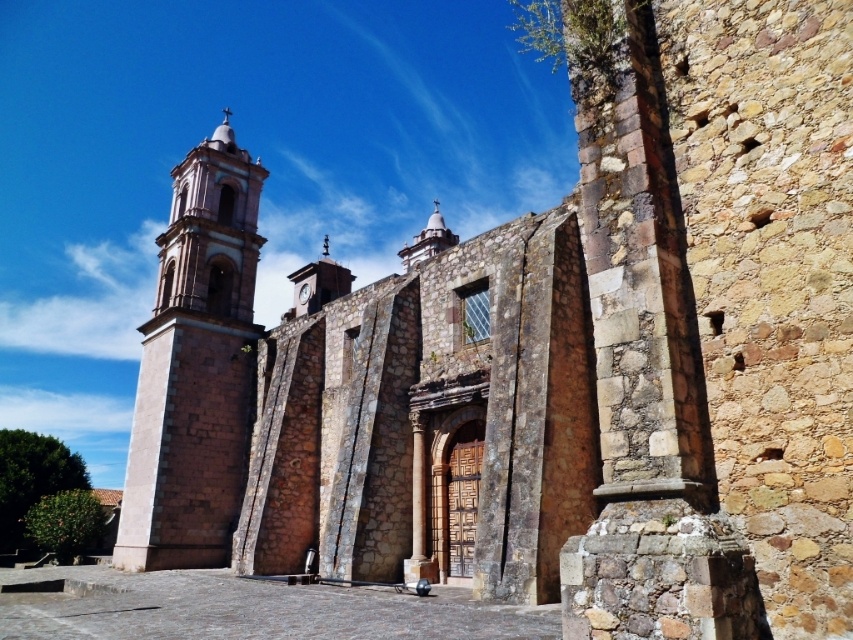
Question: Which point appears farthest from the camera in this image?

Choices:
 (A) (302, 289)
 (B) (230, 342)

Answer: (A)

Question: Does smooth stone tower at left appear under metallic clock face at center?

Choices:
 (A) no
 (B) yes

Answer: (B)

Question: Is smooth stone tower at left smaller than metallic clock face at center?

Choices:
 (A) yes
 (B) no

Answer: (B)

Question: Among these points, which one is nearest to the camera?

Choices:
 (A) (310, 291)
 (B) (142, 420)

Answer: (B)

Question: Can you confirm if smooth stone tower at left is positioned to the left of metallic clock face at center?

Choices:
 (A) yes
 (B) no

Answer: (A)